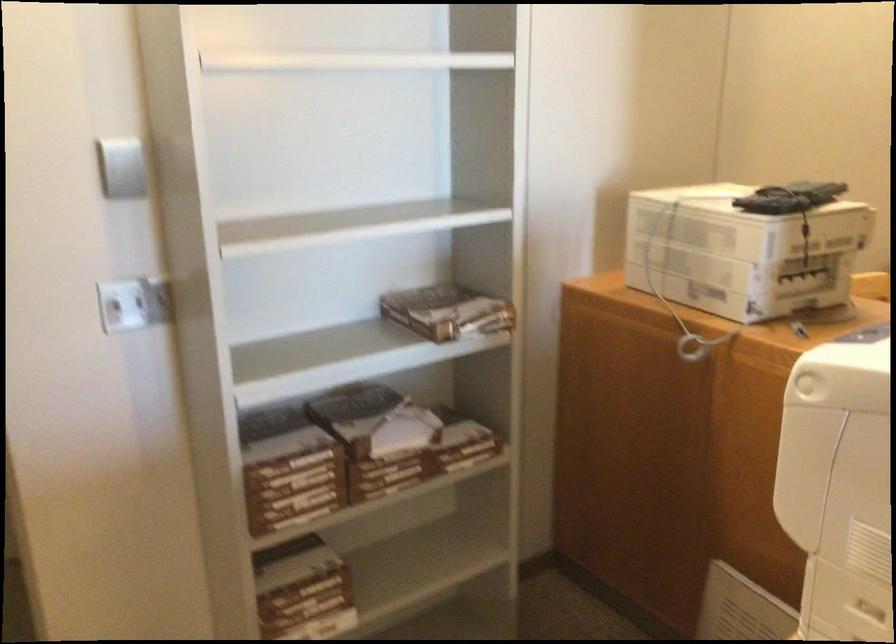
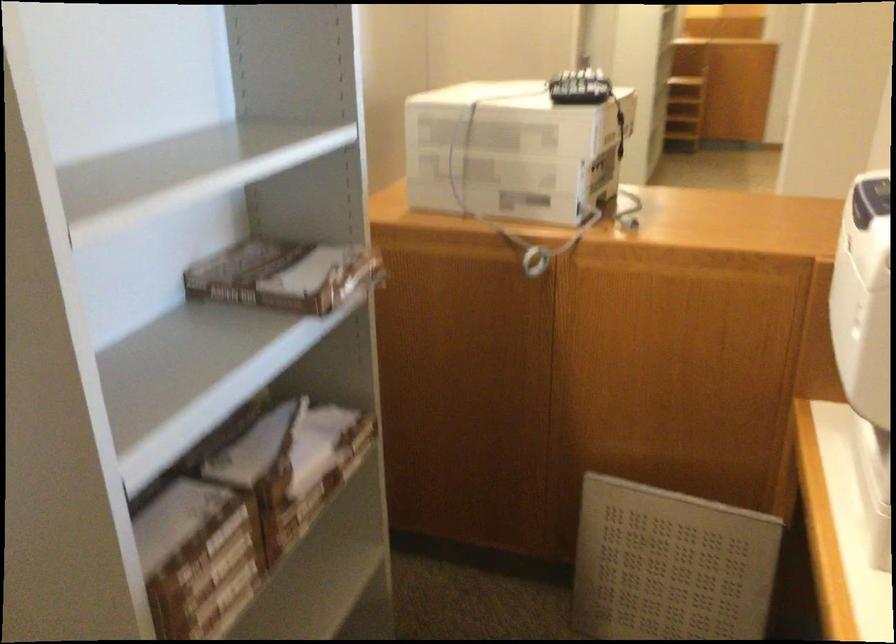
The point at (441, 305) is marked in the first image. Where is the corresponding point in the second image?

(280, 275)